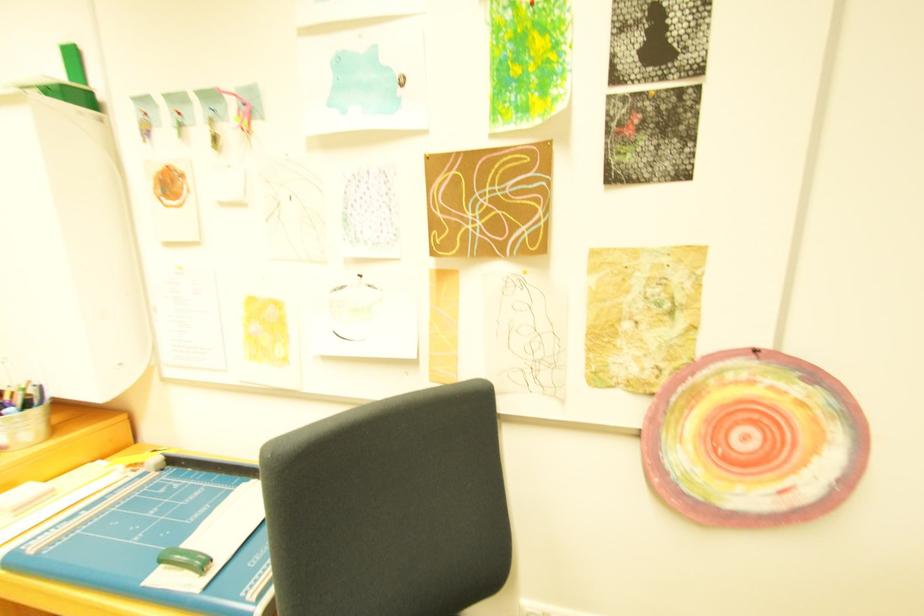
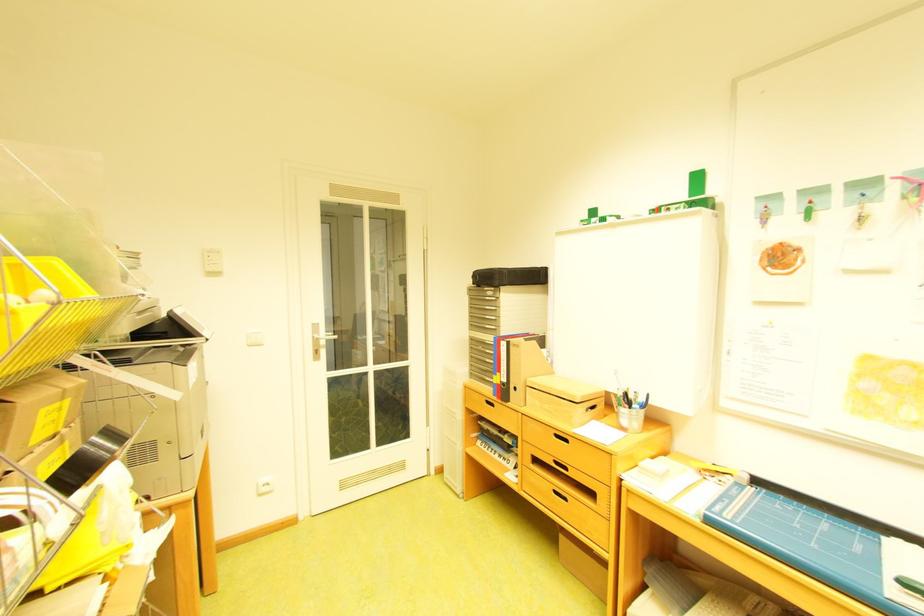
The point at (62, 544) is marked in the first image. Where is the corresponding point in the second image?

(747, 517)